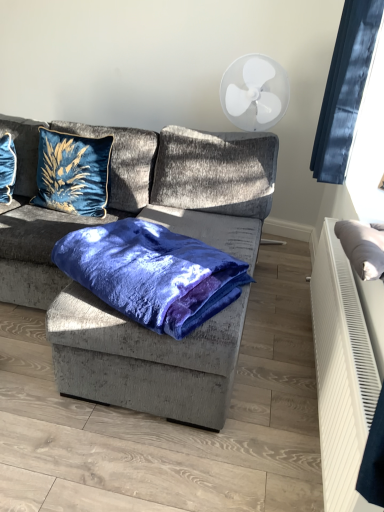
Where is `vacant space in black fabric at upper right (from a real-world perspective)`? vacant space in black fabric at upper right (from a real-world perspective) is located at coordinates point(294,278).